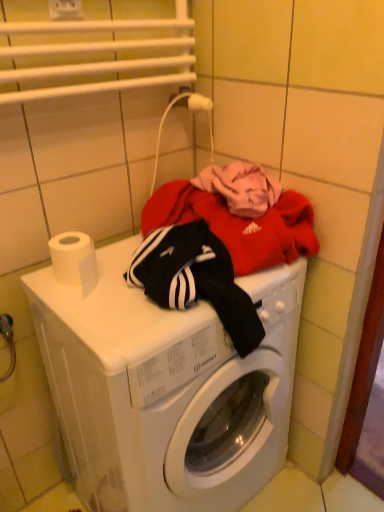
You are a GUI agent. You are given a task and a screenshot of the screen. Output one action in this format:
    pyautogui.click(x=<x>, y=<y>)
    Task: Click on the free space above white plastic washing machine at center (from a real-world perspective)
    The height and width of the screenshot is (512, 384).
    Given the screenshot: What is the action you would take?
    pyautogui.click(x=122, y=286)